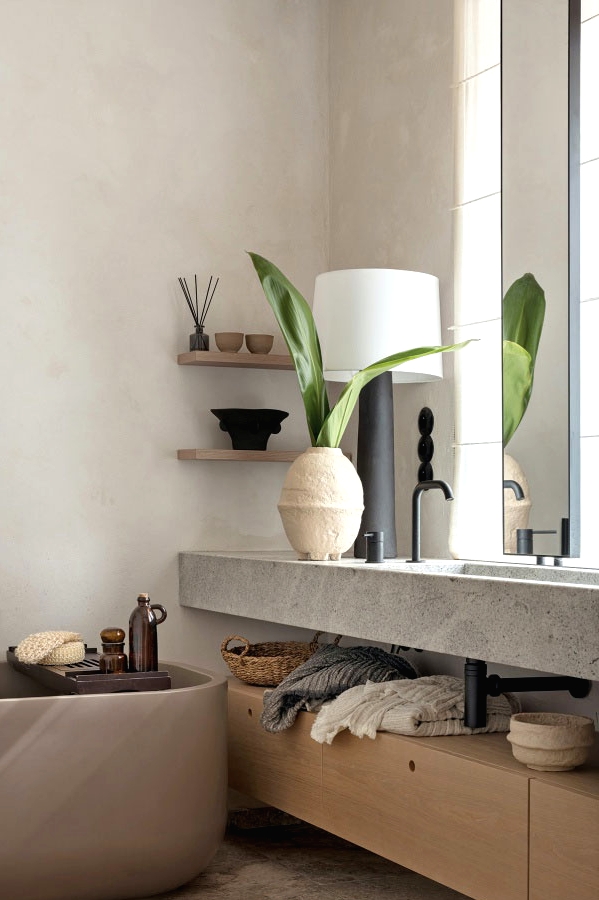
Locate an element on the screen. The height and width of the screenshot is (900, 599). finger pull is located at coordinates [410, 763], [250, 715].